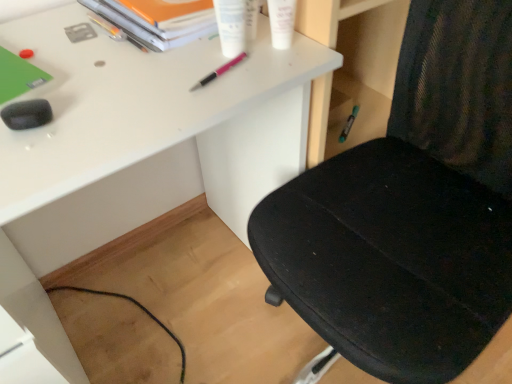
Question: Considering the relative sizes of pink metallic pen at upper center, the third stationery positioned from the left, and metallic silver pen at upper left, the second stationery viewed from the left, in the image provided, is pink metallic pen at upper center, the third stationery positioned from the left, shorter than metallic silver pen at upper left, the second stationery viewed from the left,?

Choices:
 (A) yes
 (B) no

Answer: (A)

Question: Could metallic silver pen at upper left, placed as the 2th stationery when sorted from back to front, be considered to be inside pink metallic pen at upper center, the third stationery positioned from the left?

Choices:
 (A) no
 (B) yes

Answer: (A)

Question: Considering the relative positions of pink metallic pen at upper center, the 4th stationery when ordered from right to left, and metallic silver pen at upper left, the fifth stationery positioned from the front, in the image provided, is pink metallic pen at upper center, the 4th stationery when ordered from right to left, to the left of metallic silver pen at upper left, the fifth stationery positioned from the front, from the viewer's perspective?

Choices:
 (A) yes
 (B) no

Answer: (B)

Question: From the image's perspective, is pink metallic pen at upper center, placed as the third stationery when sorted from back to front, beneath metallic silver pen at upper left, the second stationery viewed from the left?

Choices:
 (A) yes
 (B) no

Answer: (A)

Question: Is pink metallic pen at upper center, the third stationery positioned from the left, thinner than metallic silver pen at upper left, the second stationery viewed from the left?

Choices:
 (A) yes
 (B) no

Answer: (A)

Question: Does pink metallic pen at upper center, which is the 4th stationery from front to back, have a greater height compared to metallic silver pen at upper left, which is the 5th stationery in right-to-left order?

Choices:
 (A) no
 (B) yes

Answer: (A)

Question: From the image's perspective, is black mesh chair at right located above white matte desk at center?

Choices:
 (A) yes
 (B) no

Answer: (B)

Question: Is black mesh chair at right to the left of white matte desk at center from the viewer's perspective?

Choices:
 (A) yes
 (B) no

Answer: (B)

Question: Is black mesh chair at right next to white matte desk at center?

Choices:
 (A) no
 (B) yes

Answer: (A)

Question: Is black mesh chair at right not near white matte desk at center?

Choices:
 (A) yes
 (B) no

Answer: (B)

Question: From the image's perspective, is black mesh chair at right beneath white matte desk at center?

Choices:
 (A) yes
 (B) no

Answer: (A)

Question: Does black mesh chair at right have a lesser height compared to white matte desk at center?

Choices:
 (A) yes
 (B) no

Answer: (B)

Question: Is orange matte paper at upper center facing away from white matte desk at center?

Choices:
 (A) yes
 (B) no

Answer: (B)